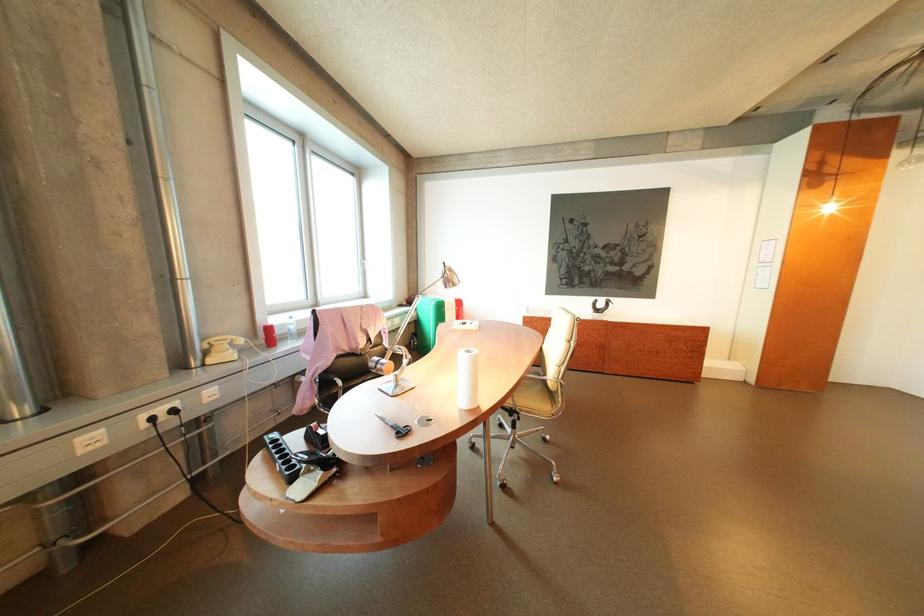
What are the coordinates of `phone handset` in the screenshot? It's located at (223, 339).